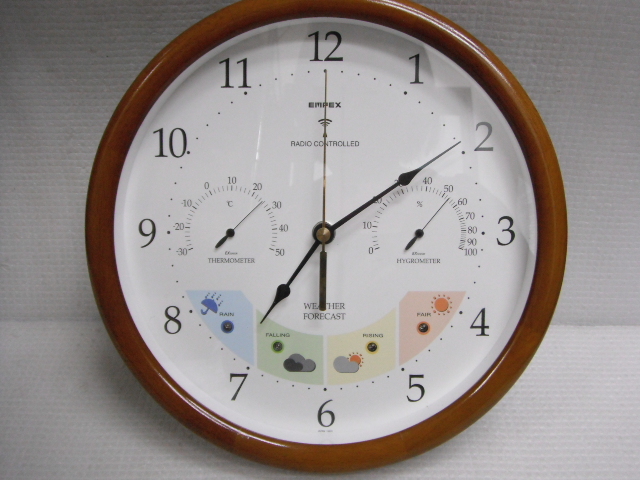
Locate an element on the screen. Image resolution: width=640 pixels, height=480 pixels. wall is located at coordinates (61, 141).